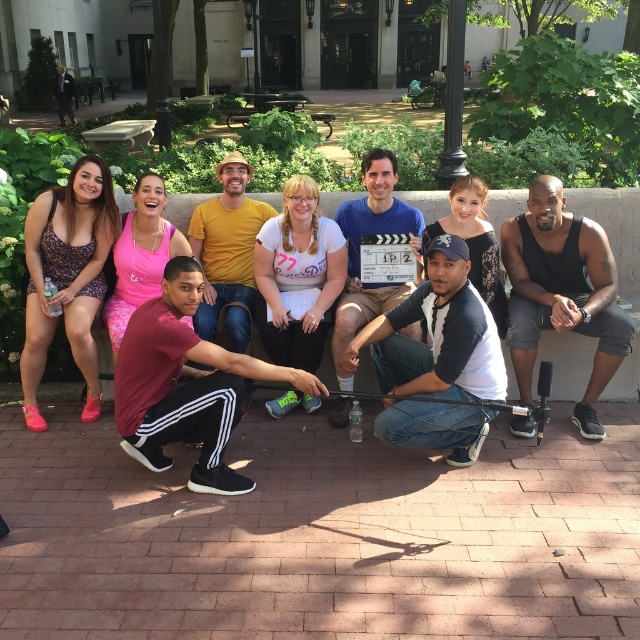
You are standing in a park and see the black tank top at center. If you want to reach it in 3 seconds, what is the minimum speed you need to move towards it?

The black tank top at center is 12.38 feet away from viewer. To cover this distance in 3 seconds, the minimum speed required is 12.38 divided by 3, which equals approximately 4.13 feet per second.

You are a photographer trying to arrange the group for a photo. You notice the maroon fabric pants at lower left and the floral fabric romper at left. Which clothing item has a wider width that might require more space in the photo setup?

The maroon fabric pants at lower left has a larger width than the floral fabric romper at left, so it requires more space in the photo setup.

You are a photographer trying to capture a closeup of the maroon fabric pants at lower left and the floral fabric romper at left. Which clothing item should you zoom in on to ensure it fills the frame more?

The maroon fabric pants at lower left is bigger than the floral fabric romper at left, so you should zoom in on the maroon fabric pants at lower left to ensure it fills the frame more.